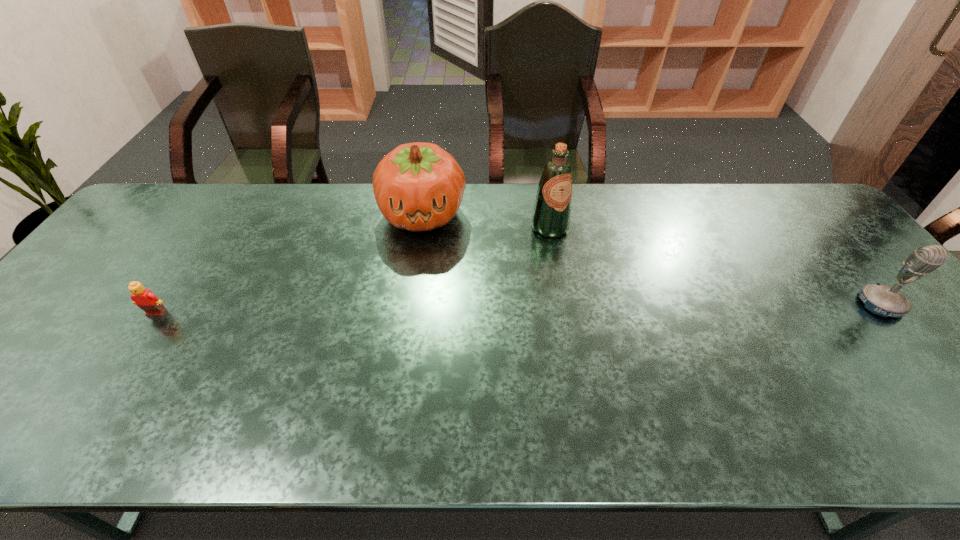
You are a GUI agent. You are given a task and a screenshot of the screen. Output one action in this format:
    pyautogui.click(x=<x>, y=<y>)
    Task: Click on the free space on the desktop that is between the shortest object and the second shortest object and is positioned on the side of the pumpkin with the cute face
    
    Given the screenshot: What is the action you would take?
    pyautogui.click(x=420, y=310)

The height and width of the screenshot is (540, 960). In order to click on vacant space on the desktop that is between the Lego and the rightmost object and is positioned on the front-facing side of the second object from right to left in this screenshot , I will do `click(613, 308)`.